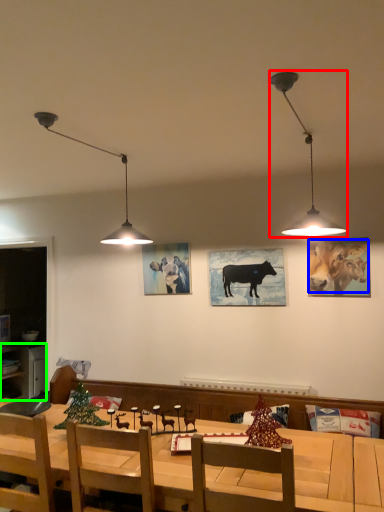
Question: Based on their relative distances, which object is nearer to lamp (highlighted by a red box)? Choose from cattle (highlighted by a blue box) and cabinetry (highlighted by a green box).

Choices:
 (A) cattle
 (B) cabinetry

Answer: (A)